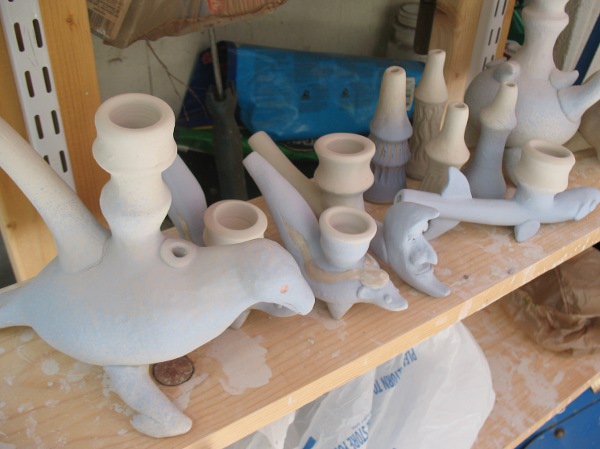
Where is `top shelf`? The image size is (600, 449). top shelf is located at coordinates (274, 344).